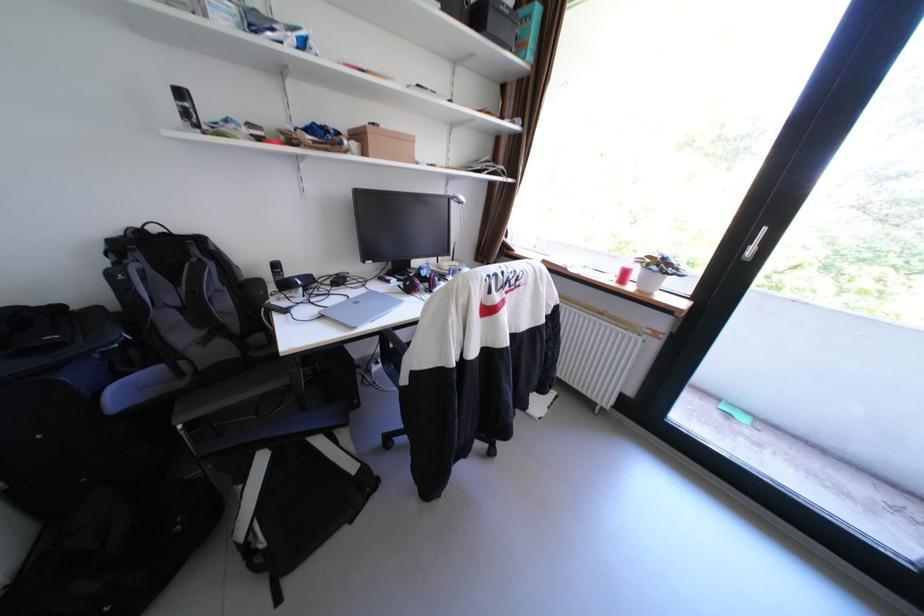
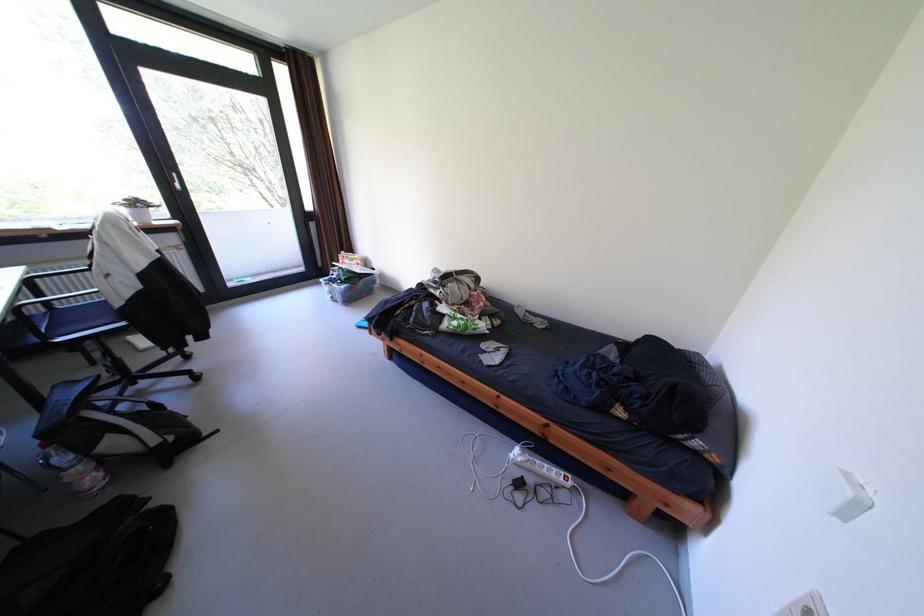
The point at (672, 265) is marked in the first image. Where is the corresponding point in the second image?

(149, 205)